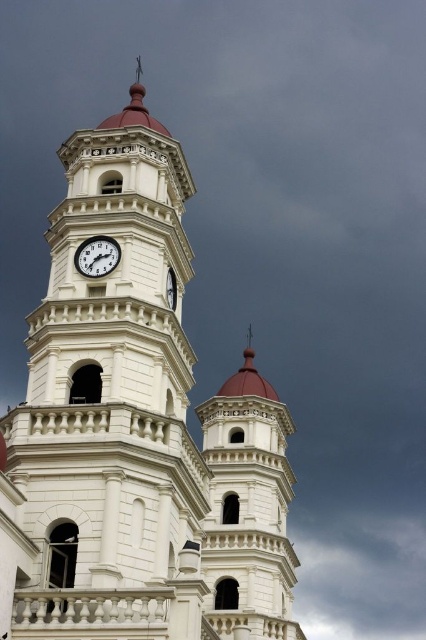
Question: Among these objects, which one is nearest to the camera?

Choices:
 (A) white glossy clock at center
 (B) cloudy sky at upper center

Answer: (A)

Question: Is white stone bell tower at center positioned behind white glossy clock at center?

Choices:
 (A) yes
 (B) no

Answer: (A)

Question: Which point is closer to the camera?

Choices:
 (A) white stone bell tower at center
 (B) white glossy clock at center

Answer: (B)

Question: Which point appears farthest from the camera in this image?

Choices:
 (A) (92, 252)
 (B) (164, 621)

Answer: (A)

Question: Does cloudy sky at upper center appear on the left side of white glossy clock at center?

Choices:
 (A) yes
 (B) no

Answer: (B)

Question: Does white stone clock tower at center have a greater width compared to white glossy clock at center?

Choices:
 (A) no
 (B) yes

Answer: (B)